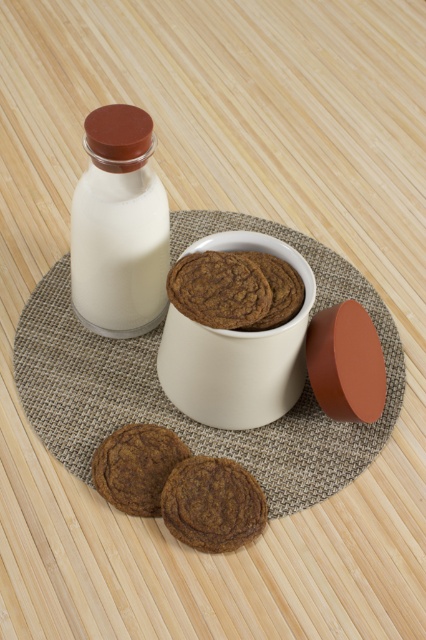
You are setting up a table for a tea party and have the white glossy bottle at upper left and the brown matte cookie at center. If you want to place a small saucer between them, which object should you position closer to the center of the table to ensure the saucer fits snugly between them?

The white glossy bottle at upper left might be wider than the brown matte cookie at center, so positioning the cookie closer to the center would allow the saucer to fit snugly between them.

You are setting up a small breakfast nook and need to place the white glossy bottle at upper left and the chocolate chip cookie at lower left on a shelf. The shelf has a maximum weight capacity of 5 kilograms. If the bottle weighs 2 kilograms and the cookie weighs 0.1 kilograms, will both items fit on the shelf without exceeding the weight limit?

The white glossy bottle at upper left weighs 2 kilograms and the chocolate chip cookie at lower left weighs 0.1 kilograms. Combined, they total 2.1 kilograms, which is under the 5 kilogram limit. Both items can be placed on the shelf safely.

You are arranging items on a table and need to place a decorative item between the white glossy bottle at upper left and the chocolate chip cookie at lower left. Based on their positions, which item should you place closer to the front of the table?

The white glossy bottle at upper left is closer to the viewer than the chocolate chip cookie at lower left, so you should place the decorative item closer to the front near the white glossy bottle at upper left to maintain the spatial arrangement.